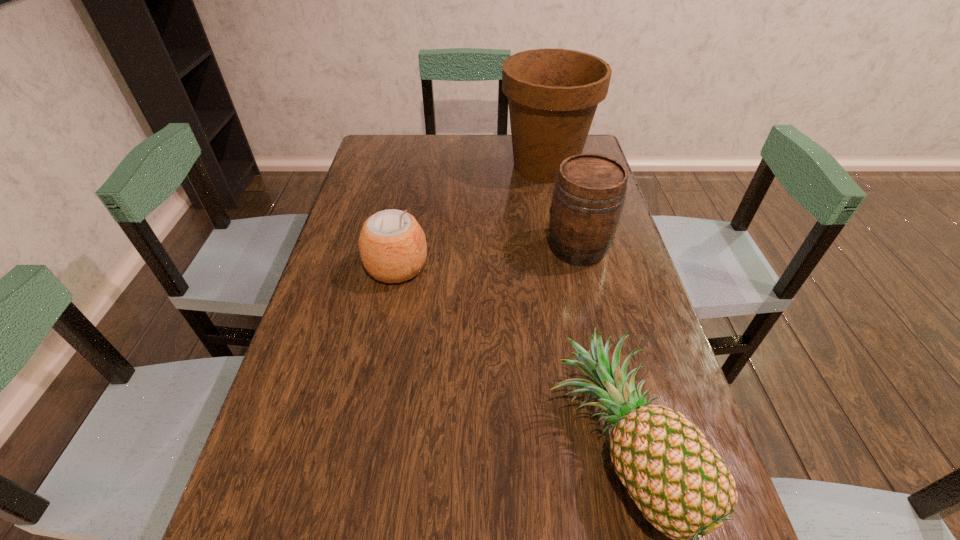
Where is `object positioned at the left edge`? object positioned at the left edge is located at coordinates (392, 245).

I want to click on flowerpot that is at the right edge, so click(x=553, y=94).

The height and width of the screenshot is (540, 960). Identify the location of cider located in the right edge section of the desktop. (589, 193).

Where is `object that is at the far right corner`? The width and height of the screenshot is (960, 540). object that is at the far right corner is located at coordinates (553, 94).

At what (x,y) coordinates should I click in order to perform the action: click on free location at the far edge. Please return your answer as a coordinate pair (x, y). The width and height of the screenshot is (960, 540). Looking at the image, I should click on (443, 157).

Locate an element on the screen. vacant space at the left edge is located at coordinates (285, 411).

Where is `vacant space at the right edge of the desktop`? vacant space at the right edge of the desktop is located at coordinates (605, 261).

Find the location of a particular element. The height and width of the screenshot is (540, 960). free space at the far left corner is located at coordinates (372, 161).

Image resolution: width=960 pixels, height=540 pixels. I want to click on free space between the coconut and the second tallest object, so click(x=488, y=257).

Where is `vacant point located between the leftmost object and the flowerpot`? vacant point located between the leftmost object and the flowerpot is located at coordinates (471, 217).